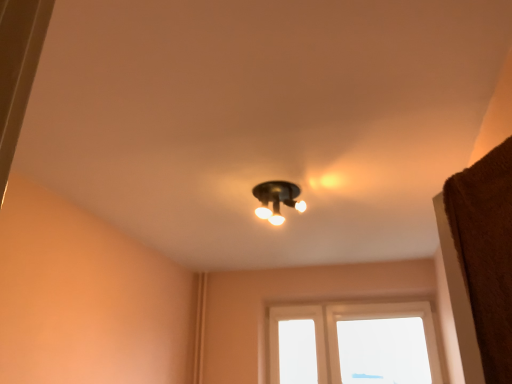
Question: Should I look upward or downward to see matte black light fixture at center?

Choices:
 (A) down
 (B) up

Answer: (A)

Question: Are matte black light fixture at center and transparent glass window at center making contact?

Choices:
 (A) yes
 (B) no

Answer: (B)

Question: Is matte black light fixture at center closer to camera compared to transparent glass window at center?

Choices:
 (A) yes
 (B) no

Answer: (A)

Question: From the image's perspective, is matte black light fixture at center under transparent glass window at center?

Choices:
 (A) yes
 (B) no

Answer: (B)

Question: Could you tell me if matte black light fixture at center is turned towards transparent glass window at center?

Choices:
 (A) no
 (B) yes

Answer: (A)

Question: Does matte black light fixture at center have a greater width compared to transparent glass window at center?

Choices:
 (A) yes
 (B) no

Answer: (A)

Question: Is matte black light fixture at center outside of transparent glass window at center?

Choices:
 (A) yes
 (B) no

Answer: (A)

Question: Can matte black light fixture at center be found inside transparent glass window at center?

Choices:
 (A) yes
 (B) no

Answer: (B)

Question: From the image's perspective, is transparent glass window at center beneath matte black light fixture at center?

Choices:
 (A) no
 (B) yes

Answer: (B)

Question: From a real-world perspective, is transparent glass window at center positioned under matte black light fixture at center based on gravity?

Choices:
 (A) no
 (B) yes

Answer: (B)

Question: Is transparent glass window at center shorter than matte black light fixture at center?

Choices:
 (A) yes
 (B) no

Answer: (B)

Question: Does transparent glass window at center appear on the right side of matte black light fixture at center?

Choices:
 (A) no
 (B) yes

Answer: (B)

Question: Is transparent glass window at center located outside matte black light fixture at center?

Choices:
 (A) no
 (B) yes

Answer: (B)

Question: Does point (275, 316) appear closer or farther from the camera than point (290, 205)?

Choices:
 (A) farther
 (B) closer

Answer: (A)